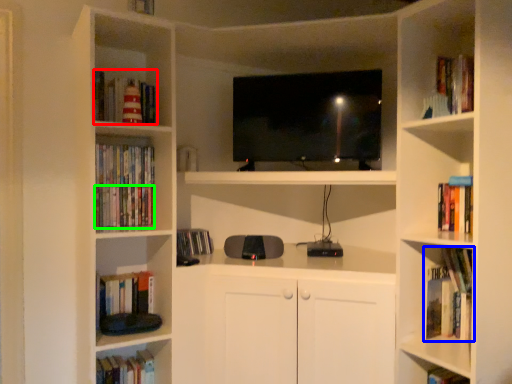
Question: Which object is the closest to the book (highlighted by a red box)? Choose among these: book (highlighted by a blue box) or book (highlighted by a green box).

Choices:
 (A) book
 (B) book

Answer: (B)